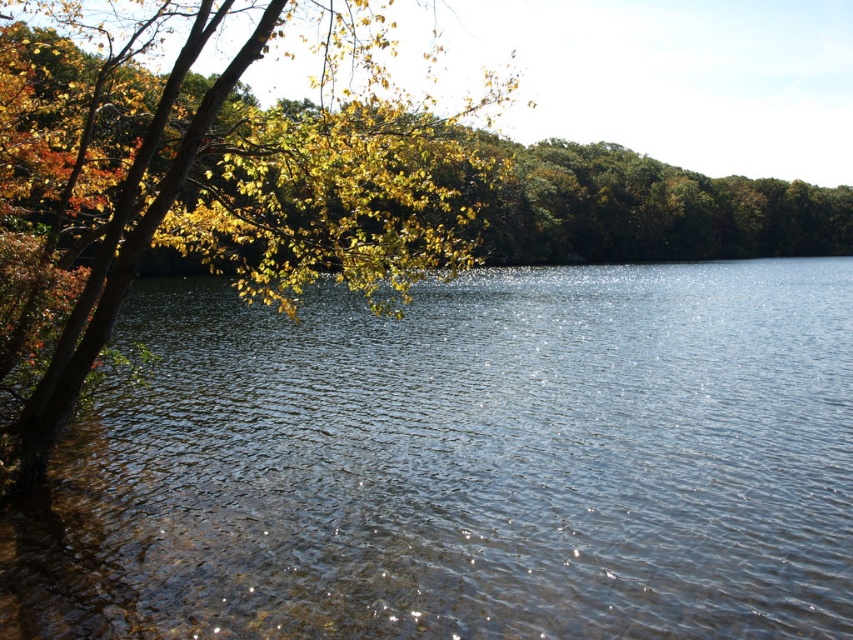
Question: Can you confirm if clear water at center is bigger than yellow-green leaves at left?

Choices:
 (A) yes
 (B) no

Answer: (B)

Question: Is clear water at center wider than yellow-green leaves at left?

Choices:
 (A) yes
 (B) no

Answer: (A)

Question: Which point is farther to the camera?

Choices:
 (A) (721, 374)
 (B) (386, 42)

Answer: (A)

Question: Does clear water at center appear under yellow-green leaves at left?

Choices:
 (A) no
 (B) yes

Answer: (B)

Question: Which point is farther to the camera?

Choices:
 (A) (26, 282)
 (B) (722, 420)

Answer: (B)

Question: Among these objects, which one is nearest to the camera?

Choices:
 (A) yellow-green leaves at left
 (B) clear water at center

Answer: (B)